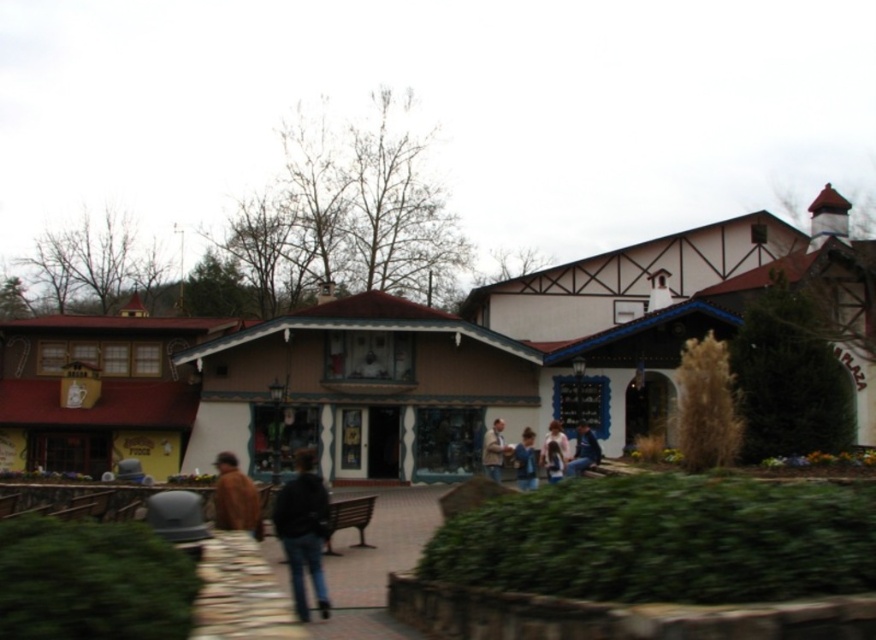
Question: Is white wood building at center wider than blue denim jeans at lower right?

Choices:
 (A) no
 (B) yes

Answer: (B)

Question: Which of the following is the closest to the observer?

Choices:
 (A) dark blue jeans at lower left
 (B) matte brown building at center
 (C) brown leather jacket at lower left
 (D) dark brown wooden bench at center

Answer: (A)

Question: Does brown leather jacket at lower left have a lesser width compared to blue denim jeans at lower right?

Choices:
 (A) yes
 (B) no

Answer: (B)

Question: Based on their relative distances, which object is nearer to the light brown leather jacket at center?

Choices:
 (A) brown leather jacket at lower left
 (B) white wood building at center

Answer: (B)

Question: Which object appears closest to the camera in this image?

Choices:
 (A) brown leather jacket at center
 (B) brown leather jacket at lower left
 (C) light brown leather jacket at center
 (D) blue denim jeans at lower right

Answer: (B)

Question: Can you confirm if matte brown building at center is positioned to the right of blue denim jeans at lower right?

Choices:
 (A) yes
 (B) no

Answer: (B)